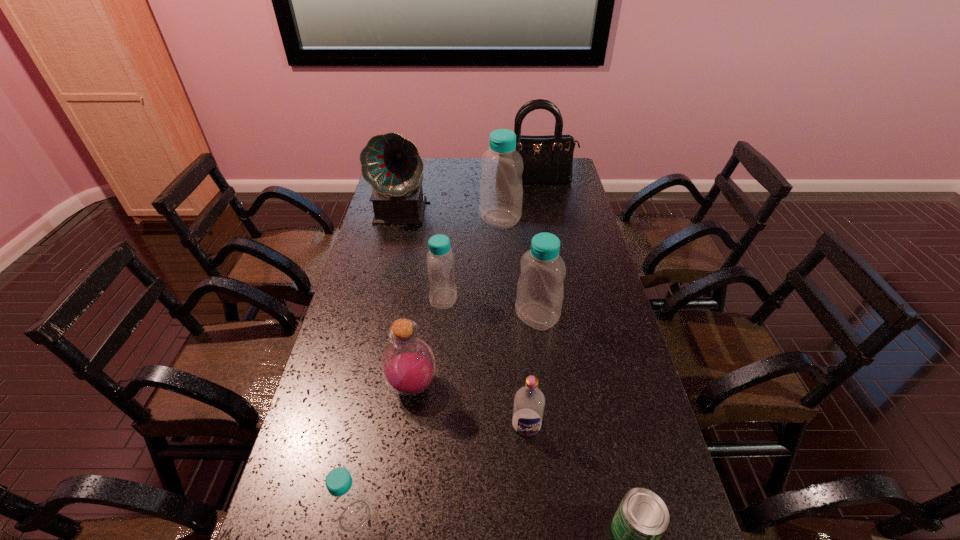
Find the location of a particular element. This screenshot has width=960, height=540. free space between the second smallest blue bottle and the nearest blue bottle is located at coordinates (399, 407).

At what (x,y) coordinates should I click in order to perform the action: click on free space that is in between the leftmost blue bottle and the farthest object. Please return your answer as a coordinate pair (x, y). Image resolution: width=960 pixels, height=540 pixels. Looking at the image, I should click on (444, 349).

At what (x,y) coordinates should I click in order to perform the action: click on free area in between the record player and the biggest blue bottle. Please return your answer as a coordinate pair (x, y). This screenshot has height=540, width=960. Looking at the image, I should click on (452, 215).

Locate an element on the screen. This screenshot has width=960, height=540. free spot between the third smallest blue bottle and the shortest bottle is located at coordinates (445, 416).

Locate an element on the screen. This screenshot has width=960, height=540. object that is the eighth closest one to the sixth farthest object is located at coordinates (548, 159).

Locate which object ranks eighth in proximity to the biggest blue bottle. Please provide its 2D coordinates. Your answer should be formatted as a tuple, i.e. [(x, y)], where the tuple contains the x and y coordinates of a point satisfying the conditions above.

[(642, 517)]

The width and height of the screenshot is (960, 540). What are the coordinates of `bottle that can be found as the closest to the seventh farthest object` in the screenshot? It's located at (408, 366).

Locate an element on the screen. bottle that is the closest to the farthest bottle is located at coordinates (440, 259).

I want to click on blue bottle that stands as the closest to the record player, so click(x=501, y=190).

Locate which blue bottle is the second closest to the second smallest blue bottle. Please provide its 2D coordinates. Your answer should be formatted as a tuple, i.e. [(x, y)], where the tuple contains the x and y coordinates of a point satisfying the conditions above.

[(501, 190)]